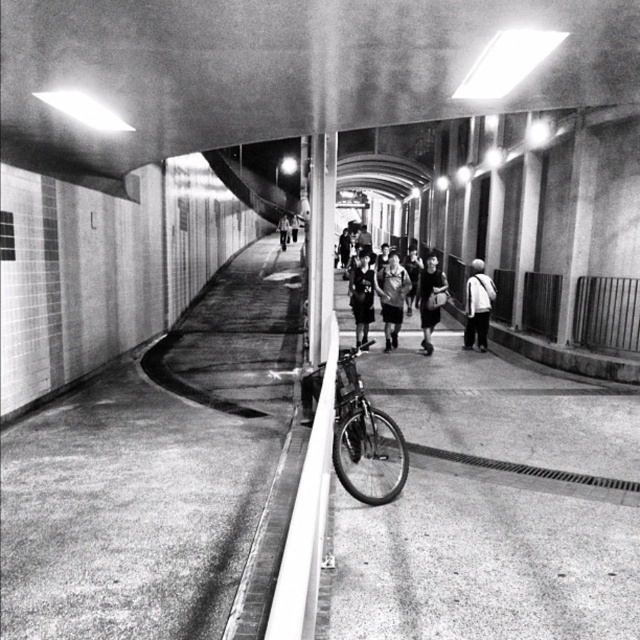
Question: Which point is farther to the camera?

Choices:
 (A) light gray fabric jacket at center
 (B) dark gray fabric bag at center

Answer: (B)

Question: Can you confirm if white fabric bag at center is positioned to the left of dark gray uniform at center?

Choices:
 (A) no
 (B) yes

Answer: (A)

Question: Which of the following is the farthest from the observer?

Choices:
 (A) (428, 288)
 (B) (356, 340)
 (C) (394, 252)
 (D) (285, 241)

Answer: (D)

Question: Can you confirm if shiny metallic bicycle at center is positioned below dark gray fabric jacket at center?

Choices:
 (A) no
 (B) yes

Answer: (B)

Question: Can you confirm if shiny metallic bicycle at center is wider than light gray fabric jacket at center?

Choices:
 (A) yes
 (B) no

Answer: (A)

Question: Which object is the closest to the dark gray uniform at center?

Choices:
 (A) white fabric bag at center
 (B) dark gray fabric bag at center

Answer: (B)